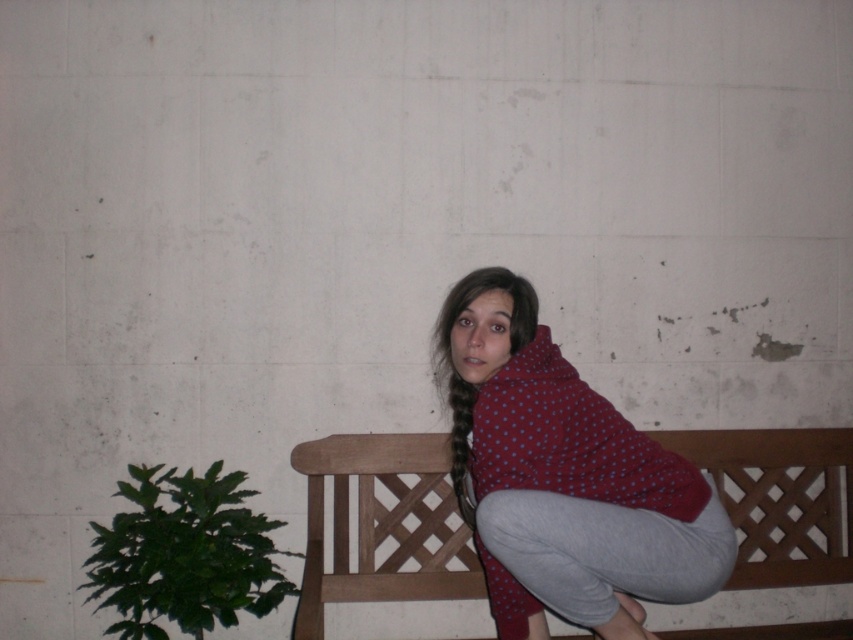
You are a delivery person who needs to place a small package on the bench. The package is 24 inches long. Can you fit the package horizontally between the polka dot fleece at center and the wooden at center on the bench?

The polka dot fleece at center is 24.17 inches away from wooden at center. Since the package is 24 inches long, it can fit horizontally between them as the distance is slightly more than the package length.

You are an interior designer planning to place a new decorative item at coordinate point 0.747, 0.662. The scene already has a polka dot fleece at center. Is there already an object at the desired coordinate?

Yes, the polka dot fleece at center is already located at the coordinate point (564, 477).